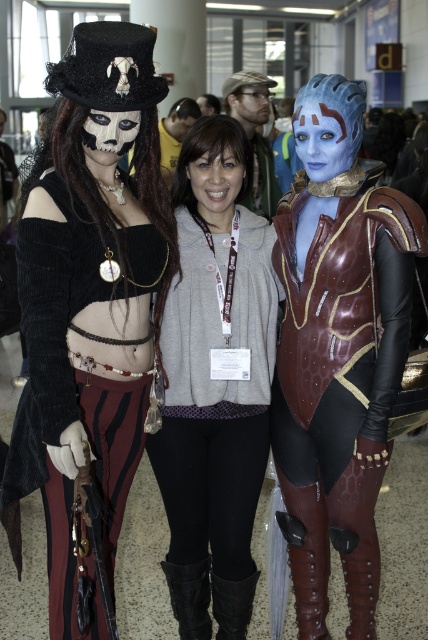
In the scene shown: Does blue metallic armor at right have a smaller size compared to gray fleece hoodie at center?

Incorrect, blue metallic armor at right is not smaller in size than gray fleece hoodie at center.

Consider the image. Is blue metallic armor at right further to the viewer compared to gray fleece hoodie at center?

No, it is in front of gray fleece hoodie at center.

Does point (282, 481) come behind point (222, 244)?

Yes, it is.

You are a GUI agent. You are given a task and a screenshot of the screen. Output one action in this format:
    pyautogui.click(x=<x>, y=<y>)
    Task: Click on the blue metallic armor at right
    The width and height of the screenshot is (428, 640).
    Given the screenshot: What is the action you would take?
    [x=338, y=349]

Does matte black hat at left have a lesser width compared to gray fleece hoodie at center?

Yes, matte black hat at left is thinner than gray fleece hoodie at center.

From the picture: Is matte black hat at left smaller than gray fleece hoodie at center?

No, matte black hat at left is not smaller than gray fleece hoodie at center.

Between point (68, 113) and point (231, 403), which one is positioned behind?

Positioned behind is point (231, 403).

Locate an element on the screen. The height and width of the screenshot is (640, 428). matte black hat at left is located at coordinates (89, 307).

Who is positioned more to the right, matte black hat at left or blue metallic armor at right?

Positioned to the right is blue metallic armor at right.

Does matte black hat at left appear under blue metallic armor at right?

Incorrect, matte black hat at left is not positioned below blue metallic armor at right.

Who is more forward, (53, 289) or (354, 412)?

Point (53, 289) is in front.

At what (x,y) coordinates should I click in order to perform the action: click on matte black hat at left. Please return your answer as a coordinate pair (x, y). Looking at the image, I should click on (89, 307).